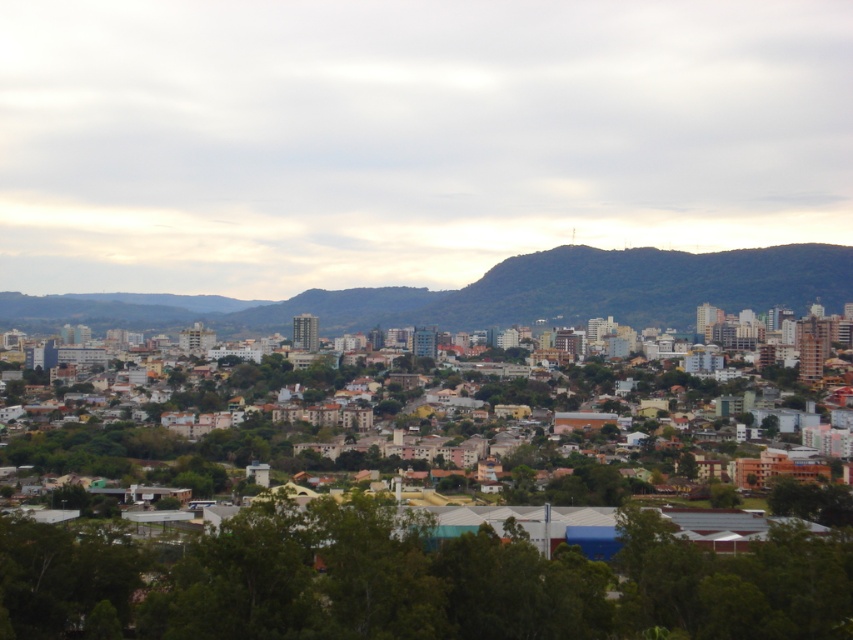
You are an urban planner assessing the city layout. You need to determine if the green leafy tree at lower center can be moved closer to the green forested mountain at center without blocking the view of the mountain from the city buildings in the foreground. Based on their widths, is this feasible?

The green leafy tree at lower center has a lesser width compared to the green forested mountain at center. Since the tree is narrower, moving it closer might not significantly block the mountain view as long as its placement doesn not obstruct the line of sight from the buildings.

Looking at this image, you are standing in the city and see the green leafy tree at lower center and the green forested mountain at center. Which one is positioned to the left when viewed from your perspective?

The green leafy tree at lower center is positioned to the left of the green forested mountain at center.

You are standing at the edge of the city looking towards the mountains. You see the green leafy tree at lower center and the green forested mountain at center. Which object appears taller in the scene?

The green leafy tree at lower center appears taller than the green forested mountain at center.